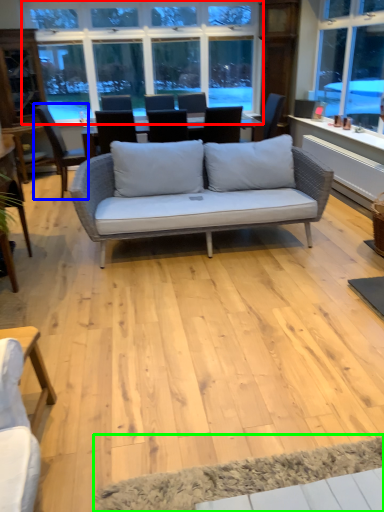
Question: Based on their relative distances, which object is farther from window (highlighted by a red box)? Choose from chair (highlighted by a blue box) and yoga mat (highlighted by a green box).

Choices:
 (A) chair
 (B) yoga mat

Answer: (B)